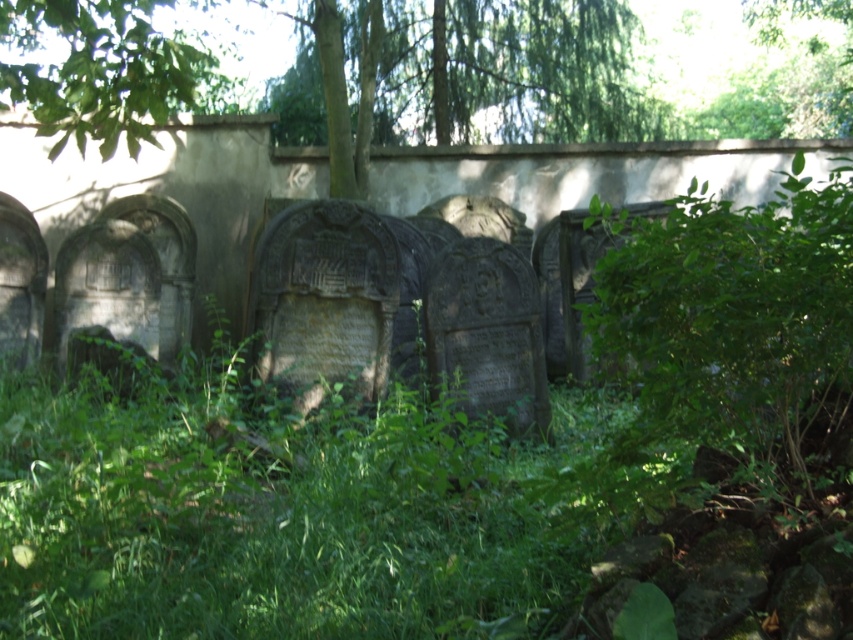
Question: Considering the relative positions of green leafy tree at upper left and green leafy tree at upper right in the image provided, where is green leafy tree at upper left located with respect to green leafy tree at upper right?

Choices:
 (A) above
 (B) below

Answer: (B)

Question: Which object appears farthest from the camera in this image?

Choices:
 (A) green leafy tree at upper center
 (B) green leafy tree at upper right
 (C) green leafy tree at upper left

Answer: (B)

Question: From the image, what is the correct spatial relationship of green leafy tree at upper center in relation to green leafy tree at upper right?

Choices:
 (A) above
 (B) below

Answer: (B)

Question: Which object is the closest to the green leafy tree at upper left?

Choices:
 (A) green leafy tree at upper center
 (B) green leafy tree at upper right

Answer: (A)

Question: Which point is farther to the camera?

Choices:
 (A) green leafy tree at upper right
 (B) green leafy tree at upper left

Answer: (A)

Question: Can you confirm if green leafy tree at upper center is positioned to the left of green leafy tree at upper right?

Choices:
 (A) no
 (B) yes

Answer: (B)